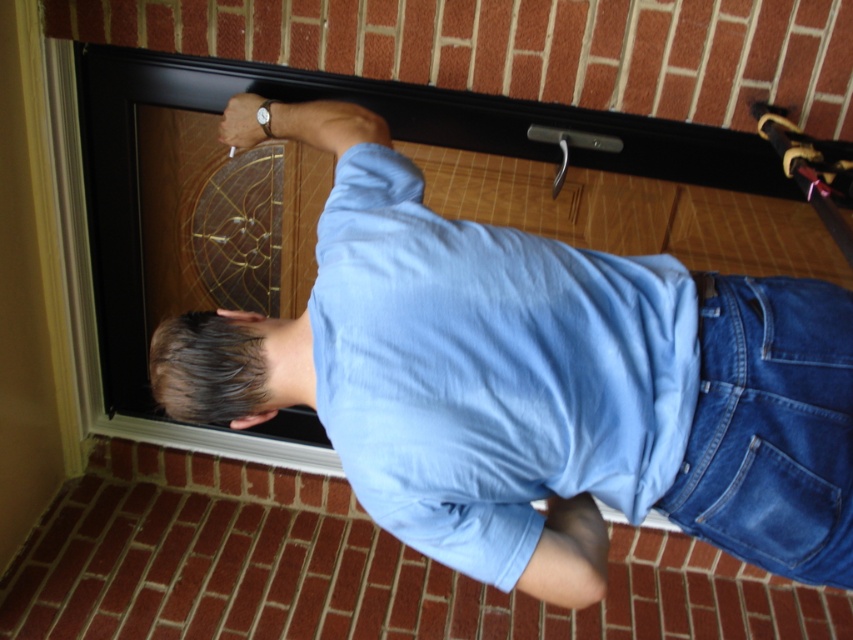
Question: Can you confirm if light blue cotton shirt at center is positioned below denim at lower right?

Choices:
 (A) yes
 (B) no

Answer: (B)

Question: Which of the following is the closest to the observer?

Choices:
 (A) blue denim shirt at upper center
 (B) denim at lower right

Answer: (B)

Question: Does blue denim shirt at upper center appear under denim at lower right?

Choices:
 (A) yes
 (B) no

Answer: (B)

Question: Which object is closer to the camera taking this photo?

Choices:
 (A) denim at lower right
 (B) light blue cotton shirt at center
 (C) blue denim shirt at upper center

Answer: (A)

Question: Which point is closer to the camera taking this photo?

Choices:
 (A) (469, 522)
 (B) (511, 570)

Answer: (A)

Question: Does blue denim shirt at upper center appear under denim at lower right?

Choices:
 (A) no
 (B) yes

Answer: (A)